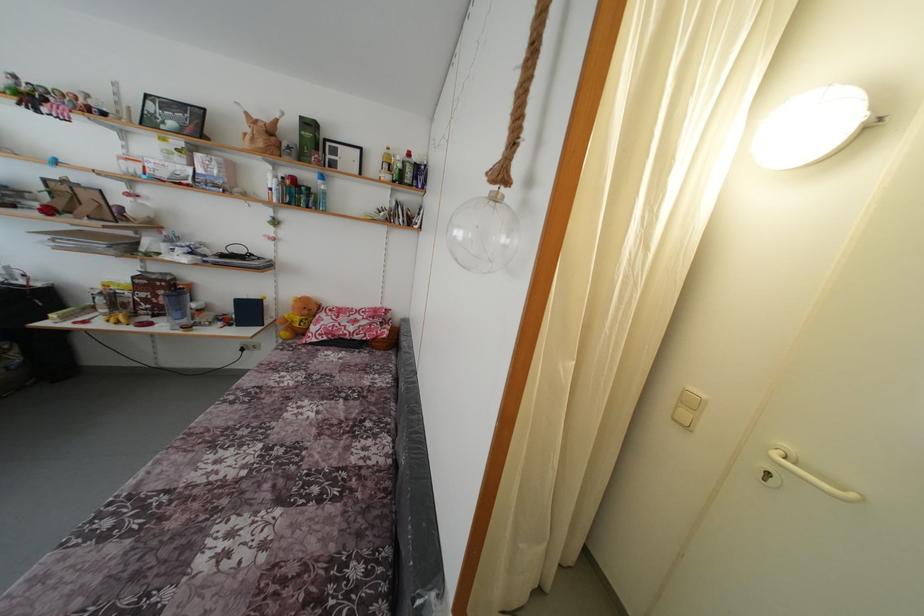
Image resolution: width=924 pixels, height=616 pixels. Describe the element at coordinates (816, 480) in the screenshot. I see `the white door handle` at that location.